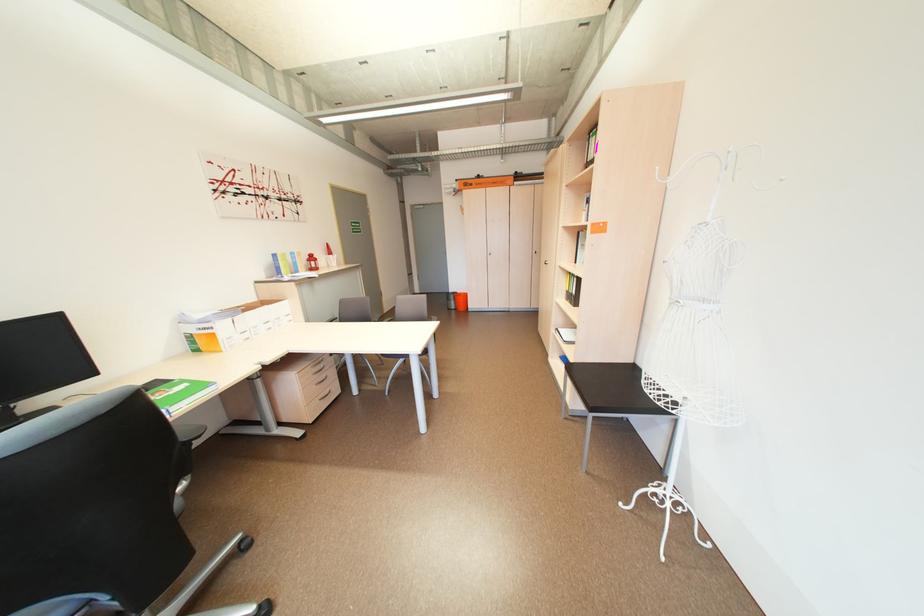
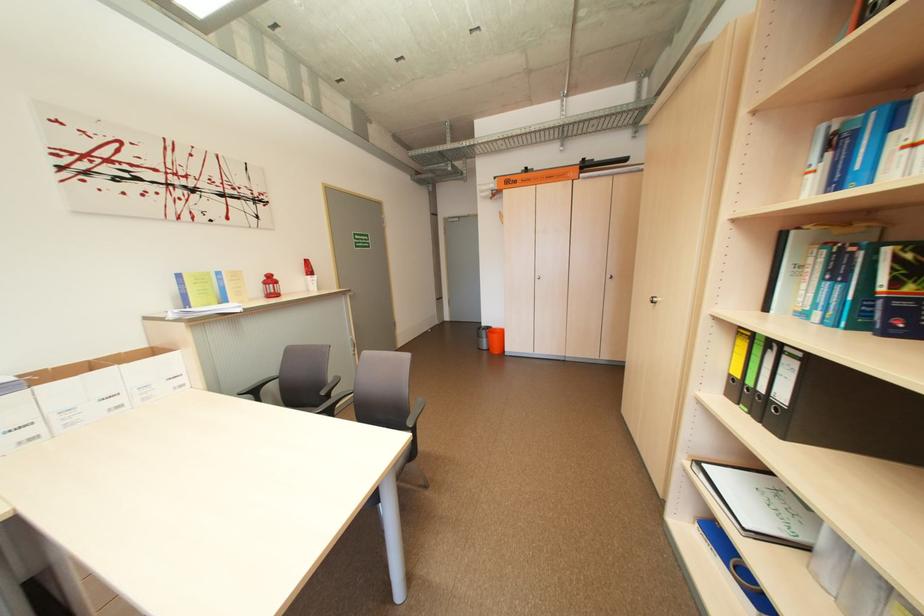
Where in the second image is the point corresponding to point (274, 304) from the first image?

(163, 353)